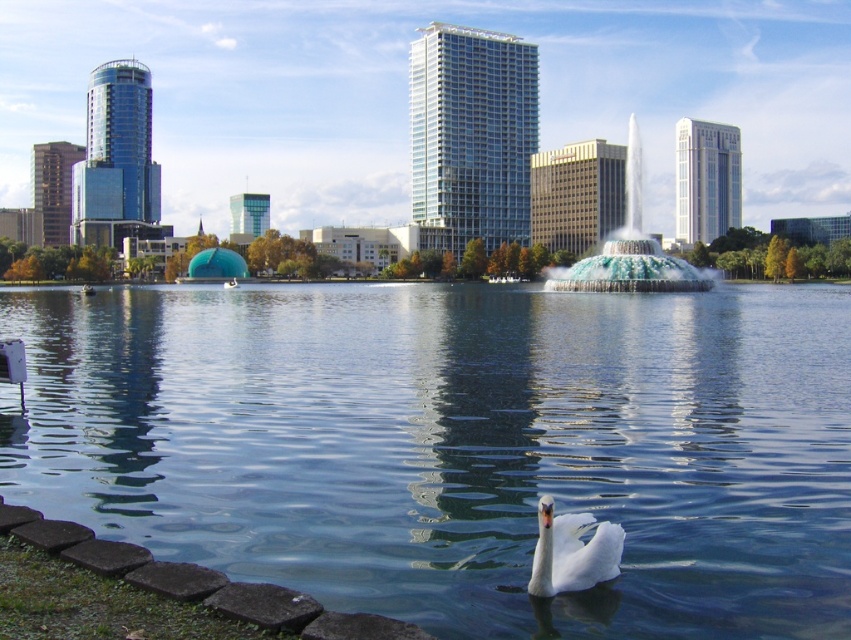
Is clear water at center to the left of white glossy swan at lower center from the viewer's perspective?

Yes, clear water at center is to the left of white glossy swan at lower center.

Does clear water at center appear over white glossy swan at lower center?

Yes, clear water at center is above white glossy swan at lower center.

This screenshot has height=640, width=851. I want to click on clear water at center, so click(455, 444).

This screenshot has width=851, height=640. I want to click on clear water at center, so click(455, 444).

Which is in front, point (373, 376) or point (630, 268)?

Point (373, 376) is more forward.

Which is behind, point (712, 529) or point (608, 291)?

Point (608, 291)

Measure the distance between point (587, 410) and camera.

The distance of point (587, 410) from camera is 14.53 meters.

At what (x,y) coordinates should I click in order to perform the action: click on clear water at center. Please return your answer as a coordinate pair (x, y). Looking at the image, I should click on (455, 444).

Can you confirm if blue glass fountain at center is thinner than white glossy swan at lower center?

No.

This screenshot has width=851, height=640. Describe the element at coordinates (630, 250) in the screenshot. I see `blue glass fountain at center` at that location.

Which is behind, point (557, 275) or point (606, 538)?

Point (557, 275)

This screenshot has width=851, height=640. Identify the location of blue glass fountain at center. (630, 250).